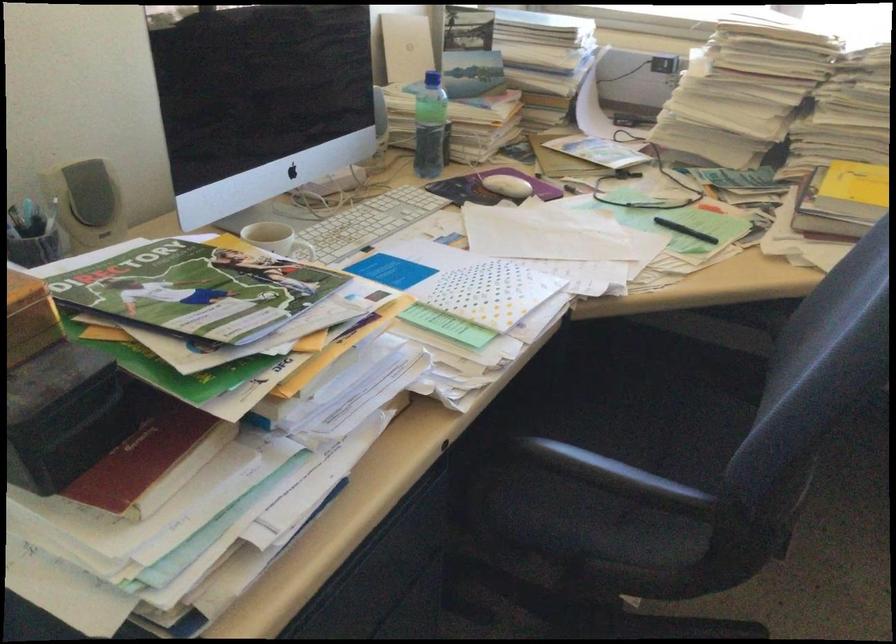
Where would you lift the white mug handle? Please return your answer as a coordinate pair (x, y).

(306, 252)